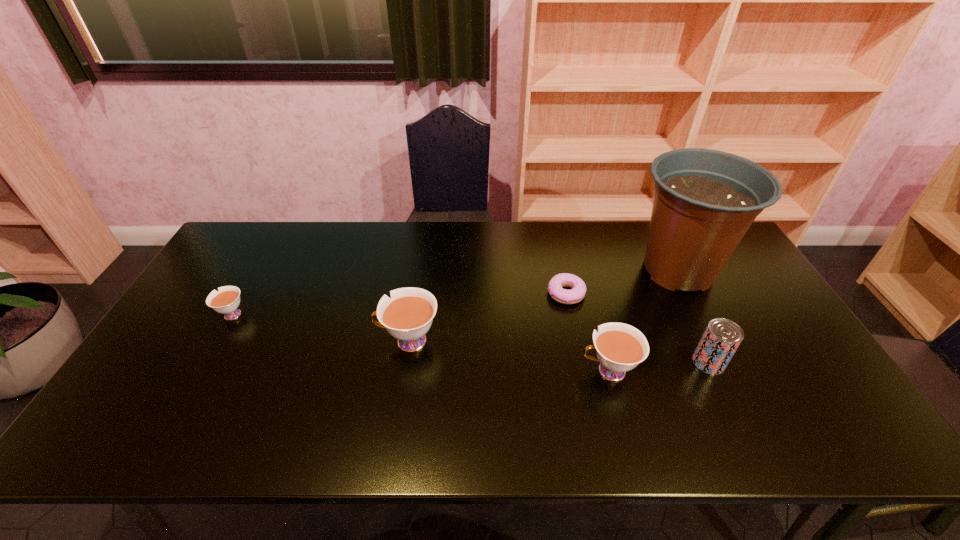
Please point a spot to add another teacup on the right. Please provide its 2D coordinates. Your answer should be formatted as a tuple, i.e. [(x, y)], where the tuple contains the x and y coordinates of a point satisfying the conditions above.

[(836, 404)]